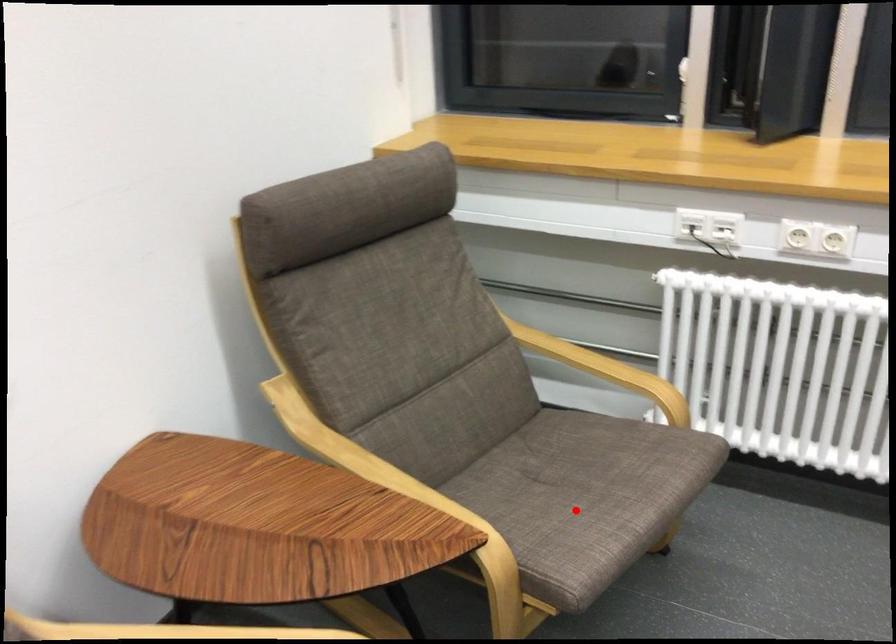
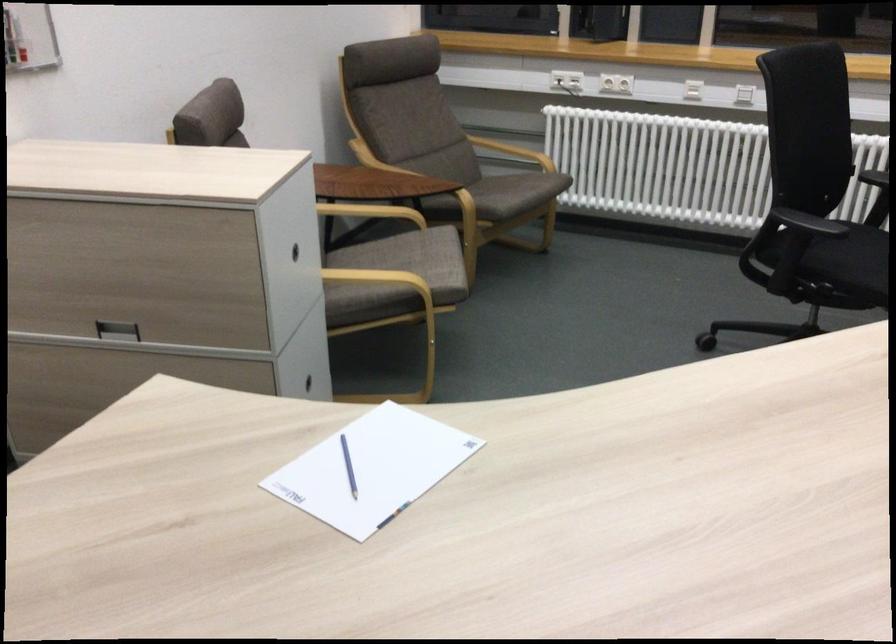
Question: I am providing you with two images of the same scene from different viewpoints. Given a red point in image1, look at the same physical point in image2. Is it:

Choices:
 (A) Closer to the viewpoint
 (B) Farther from the viewpoint

Answer: (B)